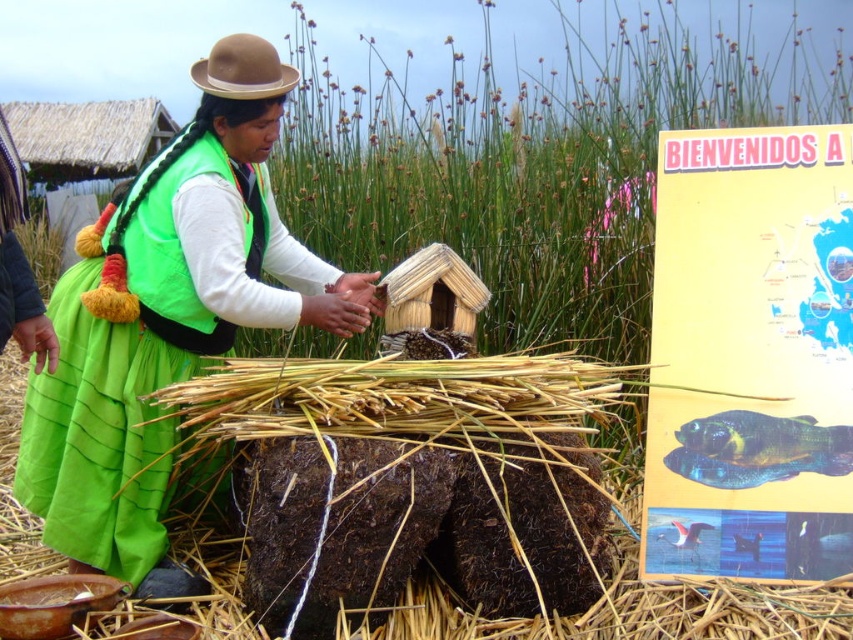
Between point (843, 275) and point (149, 486), which one is positioned behind?

Point (843, 275)

Is yellow paper sign at right shorter than green fabric skirt at center?

Yes.

Describe the element at coordinates (751, 355) in the screenshot. I see `yellow paper sign at right` at that location.

What are the coordinates of `yellow paper sign at right` in the screenshot? It's located at (751, 355).

Based on the photo, which is above, green fabric skirt at center or brown felt hat at upper left?

Positioned higher is brown felt hat at upper left.

Can you confirm if green fabric skirt at center is smaller than brown felt hat at upper left?

Actually, green fabric skirt at center might be larger than brown felt hat at upper left.

Is point (141, 404) closer to camera compared to point (262, 60)?

Yes, point (141, 404) is closer to viewer.

Find the location of a particular element. Image resolution: width=853 pixels, height=640 pixels. green fabric skirt at center is located at coordinates (161, 330).

Based on the photo, which is below, yellow paper sign at right or brown felt hat at upper left?

yellow paper sign at right is below.

Which of these two, yellow paper sign at right or brown felt hat at upper left, stands shorter?

Standing shorter between the two is brown felt hat at upper left.

Does point (701, 506) lie in front of point (219, 80)?

No, it is not.

The image size is (853, 640). I want to click on yellow paper sign at right, so click(x=751, y=355).